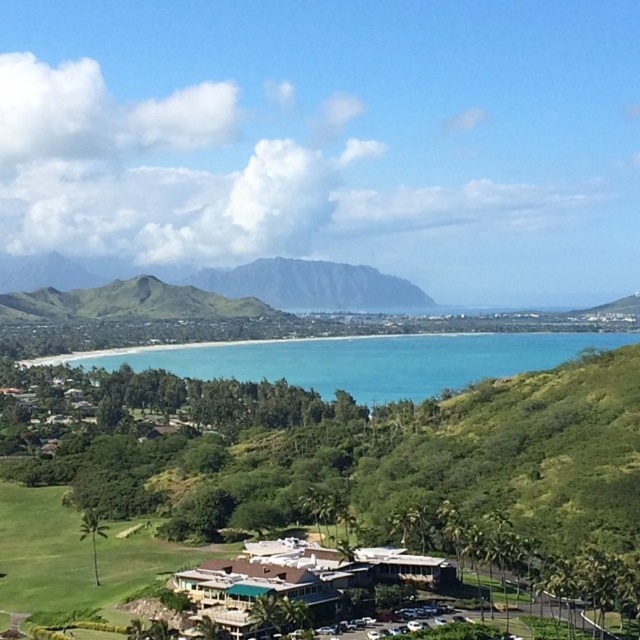
Question: Among these points, which one is nearest to the camera?

Choices:
 (A) (216, 573)
 (B) (436, 340)
 (C) (128, 291)

Answer: (A)

Question: Which of the following is the farthest from the observer?

Choices:
 (A) white textured building at center
 (B) turquoise water at center

Answer: (B)

Question: Is green grassy mountain at center wider than green grassy hill at center?

Choices:
 (A) no
 (B) yes

Answer: (B)

Question: Can you confirm if white textured building at center is positioned to the left of green grassy hill at center?

Choices:
 (A) no
 (B) yes

Answer: (A)

Question: Which of these objects is positioned closest to the green grassy mountain at center?

Choices:
 (A) white textured building at center
 (B) green grassy hill at center

Answer: (B)

Question: Can you confirm if white textured building at center is bigger than green grassy hill at center?

Choices:
 (A) no
 (B) yes

Answer: (A)